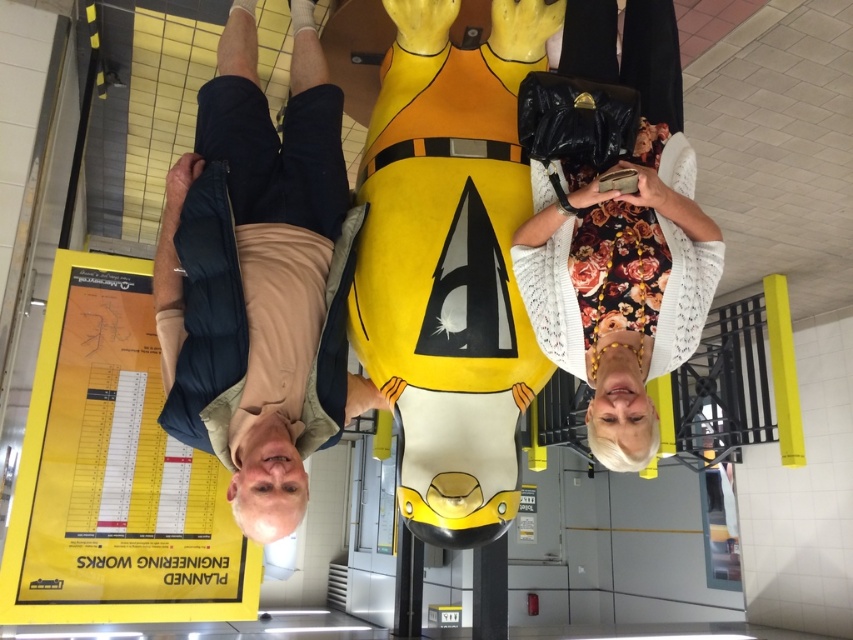
Between point (241, 29) and point (709, 291), which one is positioned in front?

Point (709, 291) is in front.

Which is below, beige fabric shirt at center or floral dress at center?

beige fabric shirt at center is lower down.

This screenshot has height=640, width=853. What do you see at coordinates (258, 262) in the screenshot?
I see `beige fabric shirt at center` at bounding box center [258, 262].

The width and height of the screenshot is (853, 640). Find the location of `beige fabric shirt at center`. beige fabric shirt at center is located at coordinates (258, 262).

From the picture: Is yellow paper poster at lower left in front of floral dress at center?

No, it is not.

Who is positioned more to the right, yellow paper poster at lower left or floral dress at center?

floral dress at center is more to the right.

Where is `yellow paper poster at lower left`? yellow paper poster at lower left is located at coordinates (114, 474).

Measure the distance from yellow paper poster at lower left to beige fabric shirt at center.

yellow paper poster at lower left and beige fabric shirt at center are 31.64 inches apart.

Between point (99, 497) and point (338, 108), which one is positioned behind?

Point (99, 497)

Which is behind, point (74, 435) or point (335, 212)?

The point (74, 435) is more distant.

The image size is (853, 640). Find the location of `yellow paper poster at lower left`. yellow paper poster at lower left is located at coordinates (114, 474).